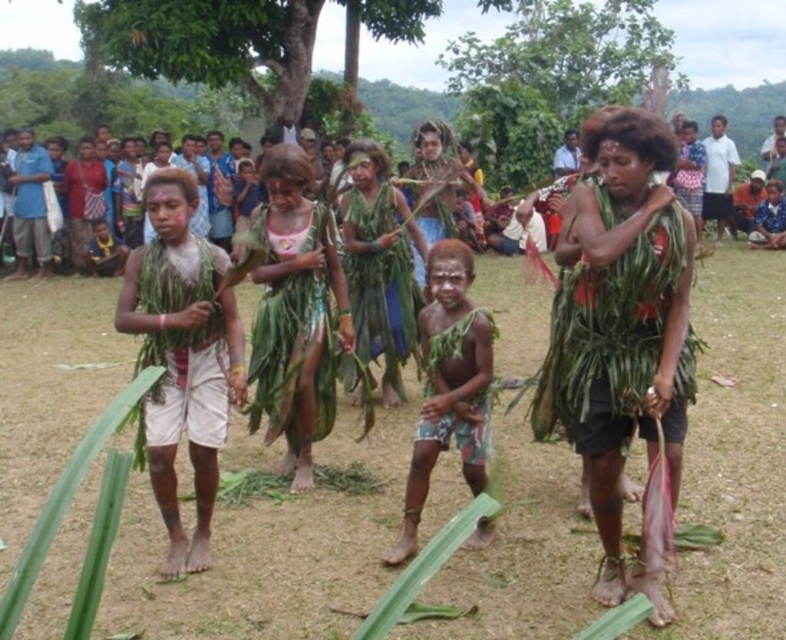
Question: Is green leafy grass at center bigger than brown textured cloth at center?

Choices:
 (A) no
 (B) yes

Answer: (B)

Question: Can you confirm if green leafy grass at center is positioned to the right of brown textured cloth at center?

Choices:
 (A) no
 (B) yes

Answer: (A)

Question: Where is green leafy grass at center located in relation to brown textured cloth at center in the image?

Choices:
 (A) right
 (B) left

Answer: (B)